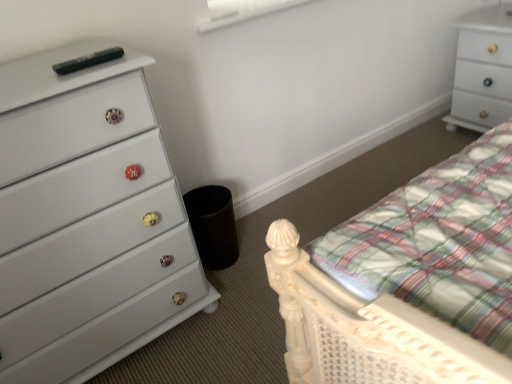
The width and height of the screenshot is (512, 384). Identify the location of white glossy chest of drawers at upper right, arranged as the 1th chest of drawers when viewed from the top. (483, 69).

The image size is (512, 384). I want to click on white glossy chest of drawers at left, the first chest of drawers positioned from the left, so click(x=87, y=219).

Locate an element on the screen. white matte window screen at upper center is located at coordinates (241, 11).

What are the coordinates of `white glossy chest of drawers at upper right, which is counted as the 1th chest of drawers, starting from the back` in the screenshot? It's located at (483, 69).

From the picture: Is white matte window screen at upper center wider or thinner than white glossy chest of drawers at left, which is the 1th chest of drawers from bottom to top?

Clearly, white matte window screen at upper center has less width compared to white glossy chest of drawers at left, which is the 1th chest of drawers from bottom to top.

Are white matte window screen at upper center and white glossy chest of drawers at left, marked as the second chest of drawers in a top-to-bottom arrangement, far apart?

No, white matte window screen at upper center is not far from white glossy chest of drawers at left, marked as the second chest of drawers in a top-to-bottom arrangement.

You are a GUI agent. You are given a task and a screenshot of the screen. Output one action in this format:
    pyautogui.click(x=<x>, y=<y>)
    Task: Click on the window screen that is above the white glossy chest of drawers at left, acting as the second chest of drawers starting from the right (from the image's perspective)
    This screenshot has height=384, width=512.
    Given the screenshot: What is the action you would take?
    pyautogui.click(x=241, y=11)

Who is smaller, white matte window screen at upper center or white glossy chest of drawers at left, which is the second chest of drawers in back-to-front order?

white matte window screen at upper center.

Is white glossy chest of drawers at upper right, the 2th chest of drawers from the left, positioned behind white glossy chest of drawers at left, which is the second chest of drawers in back-to-front order?

Yes, white glossy chest of drawers at upper right, the 2th chest of drawers from the left, is further from the camera.

Is white glossy chest of drawers at upper right, which is counted as the 1th chest of drawers, starting from the back, not near white glossy chest of drawers at left, acting as the first chest of drawers starting from the front?

Yes, white glossy chest of drawers at upper right, which is counted as the 1th chest of drawers, starting from the back, and white glossy chest of drawers at left, acting as the first chest of drawers starting from the front, are located far from each other.

Which is nearer, (475, 35) or (100, 49)?

Clearly, point (475, 35) is more distant from the camera than point (100, 49).

Which is more to the left, white glossy chest of drawers at upper right, which ranks as the 1th chest of drawers in right-to-left order, or white glossy chest of drawers at left, acting as the first chest of drawers starting from the front?

white glossy chest of drawers at left, acting as the first chest of drawers starting from the front, is more to the left.

Which is farther, (498, 32) or (215, 17)?

Positioned behind is point (498, 32).

From the image's perspective, is white glossy chest of drawers at upper right, which ranks as the second chest of drawers in bottom-to-top order, located beneath white matte window screen at upper center?

Correct, white glossy chest of drawers at upper right, which ranks as the second chest of drawers in bottom-to-top order, appears lower than white matte window screen at upper center in the image.

Relative to white matte window screen at upper center, is white glossy chest of drawers at upper right, arranged as the 1th chest of drawers when viewed from the top, in front or behind?

In the image, white glossy chest of drawers at upper right, arranged as the 1th chest of drawers when viewed from the top, appears behind white matte window screen at upper center.

Could you tell me if white glossy chest of drawers at upper right, which ranks as the second chest of drawers in bottom-to-top order, is turned towards white matte window screen at upper center?

Yes, white glossy chest of drawers at upper right, which ranks as the second chest of drawers in bottom-to-top order, is turned towards white matte window screen at upper center.

How many degrees apart are the facing directions of white glossy chest of drawers at left, marked as the second chest of drawers in a top-to-bottom arrangement, and white matte window screen at upper center?

The angular difference between white glossy chest of drawers at left, marked as the second chest of drawers in a top-to-bottom arrangement, and white matte window screen at upper center is 0.576 degrees.

From a real-world perspective, does white glossy chest of drawers at left, which is the 1th chest of drawers from bottom to top, stand above white matte window screen at upper center?

No, from a real-world perspective, white glossy chest of drawers at left, which is the 1th chest of drawers from bottom to top, is not over white matte window screen at upper center

Locate an element on the screen. the chest of drawers that appears in front of the white matte window screen at upper center is located at coordinates (87, 219).

Considering the relative sizes of white glossy chest of drawers at left, marked as the second chest of drawers in a top-to-bottom arrangement, and white glossy chest of drawers at upper right, which ranks as the 1th chest of drawers in right-to-left order, in the image provided, is white glossy chest of drawers at left, marked as the second chest of drawers in a top-to-bottom arrangement, shorter than white glossy chest of drawers at upper right, which ranks as the 1th chest of drawers in right-to-left order,?

No.

Looking at the image, does white glossy chest of drawers at left, acting as the second chest of drawers starting from the right, seem bigger or smaller compared to white glossy chest of drawers at upper right, the 2th chest of drawers from the left?

Considering their sizes, white glossy chest of drawers at left, acting as the second chest of drawers starting from the right, takes up more space than white glossy chest of drawers at upper right, the 2th chest of drawers from the left.

Which is more to the left, white glossy chest of drawers at left, acting as the first chest of drawers starting from the front, or white glossy chest of drawers at upper right, which is counted as the 1th chest of drawers, starting from the back?

white glossy chest of drawers at left, acting as the first chest of drawers starting from the front, is more to the left.

Is white glossy chest of drawers at left, which is the second chest of drawers in back-to-front order, oriented away from white glossy chest of drawers at upper right, which is counted as the 1th chest of drawers, starting from the back?

No, white glossy chest of drawers at left, which is the second chest of drawers in back-to-front order, is not facing away from white glossy chest of drawers at upper right, which is counted as the 1th chest of drawers, starting from the back.

In terms of height, does white matte window screen at upper center look taller or shorter compared to white glossy chest of drawers at upper right, the 2th chest of drawers from the left?

Considering their sizes, white matte window screen at upper center has less height than white glossy chest of drawers at upper right, the 2th chest of drawers from the left.

Is white matte window screen at upper center oriented towards white glossy chest of drawers at upper right, arranged as the 1th chest of drawers when viewed from the top?

No, white matte window screen at upper center is not turned towards white glossy chest of drawers at upper right, arranged as the 1th chest of drawers when viewed from the top.

Based on the photo, does white matte window screen at upper center contain white glossy chest of drawers at upper right, which ranks as the 1th chest of drawers in right-to-left order?

No, white glossy chest of drawers at upper right, which ranks as the 1th chest of drawers in right-to-left order, is located outside of white matte window screen at upper center.

Locate an element on the screen. window screen on the left of the white glossy chest of drawers at upper right, positioned as the second chest of drawers in front-to-back order is located at coordinates (241, 11).

Locate an element on the screen. This screenshot has height=384, width=512. the 2nd chest of drawers below when counting from the white matte window screen at upper center (from the image's perspective) is located at coordinates (87, 219).

Image resolution: width=512 pixels, height=384 pixels. I want to click on chest of drawers on the left of the white glossy chest of drawers at upper right, arranged as the 1th chest of drawers when viewed from the top, so click(x=87, y=219).

Based on their spatial positions, is white matte window screen at upper center or white glossy chest of drawers at left, which is the second chest of drawers in back-to-front order, further from white glossy chest of drawers at upper right, arranged as the 1th chest of drawers when viewed from the top?

Among the two, white glossy chest of drawers at left, which is the second chest of drawers in back-to-front order, is located further to white glossy chest of drawers at upper right, arranged as the 1th chest of drawers when viewed from the top.

When comparing their distances from white glossy chest of drawers at left, acting as the second chest of drawers starting from the right, does white glossy chest of drawers at upper right, which ranks as the second chest of drawers in bottom-to-top order, or white matte window screen at upper center seem closer?

white matte window screen at upper center is closer to white glossy chest of drawers at left, acting as the second chest of drawers starting from the right.

Based on their spatial positions, is white glossy chest of drawers at left, the first chest of drawers positioned from the left, or white matte window screen at upper center closer to white glossy chest of drawers at upper right, positioned as the second chest of drawers in front-to-back order?

The object closer to white glossy chest of drawers at upper right, positioned as the second chest of drawers in front-to-back order, is white matte window screen at upper center.

Looking at the image, which one is located further to white matte window screen at upper center, white glossy chest of drawers at upper right, which ranks as the second chest of drawers in bottom-to-top order, or white glossy chest of drawers at left, acting as the second chest of drawers starting from the right?

Among the two, white glossy chest of drawers at upper right, which ranks as the second chest of drawers in bottom-to-top order, is located further to white matte window screen at upper center.

Estimate the real-world distances between objects in this image. Which object is further from white matte window screen at upper center, white glossy chest of drawers at left, acting as the second chest of drawers starting from the right, or white glossy chest of drawers at upper right, the 2th chest of drawers from the left?

white glossy chest of drawers at upper right, the 2th chest of drawers from the left.

When comparing their distances from white glossy chest of drawers at left, which is the second chest of drawers in back-to-front order, does white matte window screen at upper center or white glossy chest of drawers at upper right, which ranks as the second chest of drawers in bottom-to-top order, seem closer?

white matte window screen at upper center is closer to white glossy chest of drawers at left, which is the second chest of drawers in back-to-front order.

Locate an element on the screen. Image resolution: width=512 pixels, height=384 pixels. window screen between white glossy chest of drawers at left, acting as the first chest of drawers starting from the front, and white glossy chest of drawers at upper right, which ranks as the 1th chest of drawers in right-to-left order, from left to right is located at coordinates (241, 11).